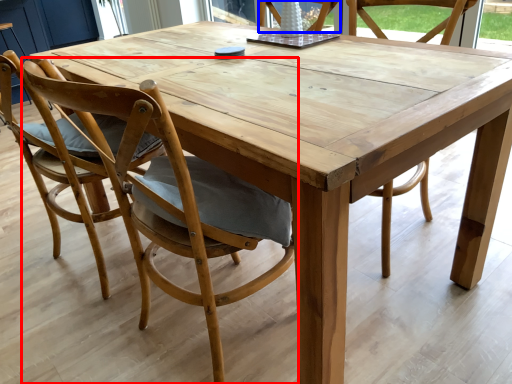
Question: Among these objects, which one is farthest to the camera, chair (highlighted by a red box) or chair (highlighted by a blue box)?

Choices:
 (A) chair
 (B) chair

Answer: (B)